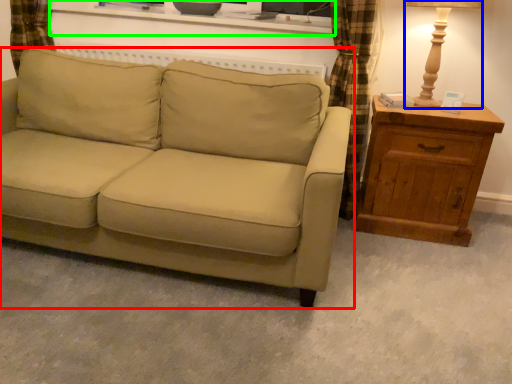
Question: Considering the real-world distances, which object is closest to studio couch (highlighted by a red box)? table lamp (highlighted by a blue box) or entertainment center (highlighted by a green box).

Choices:
 (A) table lamp
 (B) entertainment center

Answer: (B)